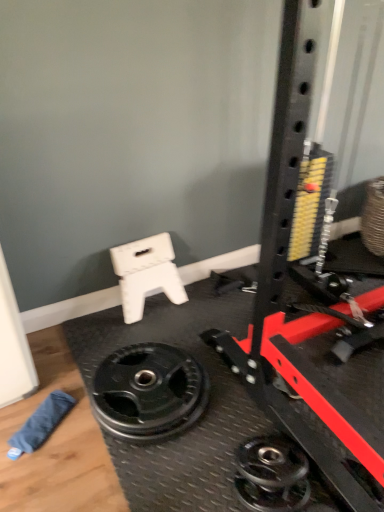
At what (x,y) coordinates should I click in order to perform the action: click on vacant space in front of black rubber weight plate at lower center. Please return your answer as a coordinate pair (x, y). The width and height of the screenshot is (384, 512). Looking at the image, I should click on (130, 477).